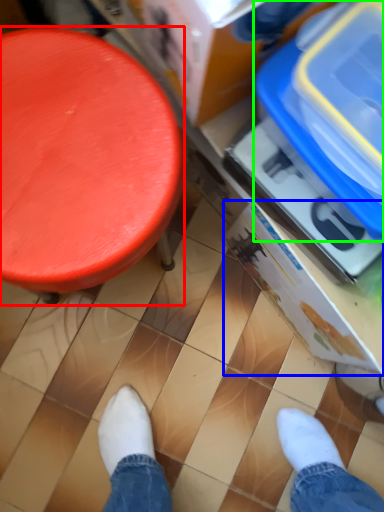
Question: Estimate the real-world distances between objects in this image. Which object is closer to furniture (highlighted by a red box), storage box (highlighted by a blue box) or storage box (highlighted by a green box)?

Choices:
 (A) storage box
 (B) storage box

Answer: (B)